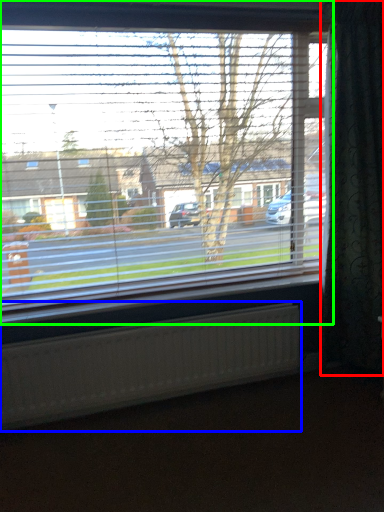
Question: Based on their relative distances, which object is farther from curtain (highlighted by a red box)? Choose from radiator (highlighted by a blue box) and window (highlighted by a green box).

Choices:
 (A) radiator
 (B) window

Answer: (A)